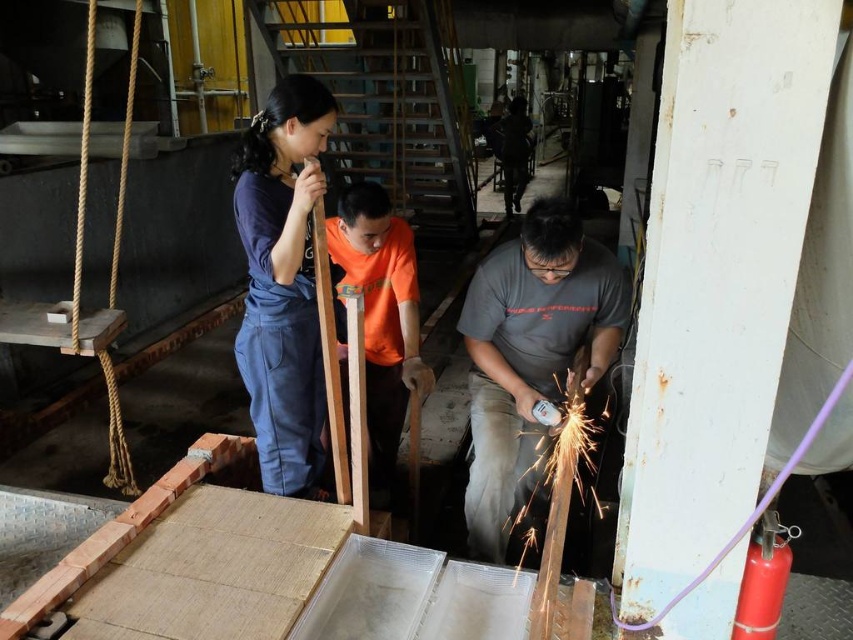
In the workshop scene, there are two workers wearing a dark blue denim jumpsuit at center and an orange cotton shirt at center. Which worker is wearing a larger garment?

The dark blue denim jumpsuit at center is bigger than the orange cotton shirt at center, so the worker wearing the dark blue denim jumpsuit at center has the larger garment.

You are a safety inspector in this workshop. You need to ensure that the two workers wearing the matte gray shirt at center and the dark blue denim jumpsuit at center are maintaining a safe distance of at least 36 inches apart. Based on the scene description, are they compliant with the safety regulations?

The matte gray shirt at center and dark blue denim jumpsuit at center are 30.28 inches apart, which is less than the required 36 inches. Therefore, they are not compliant with the safety regulations.

In the workshop scene, there are two workers wearing a dark blue denim jumpsuit at center and an orange cotton shirt at center. Which worker is taller?

The dark blue denim jumpsuit at center is taller than the orange cotton shirt at center.